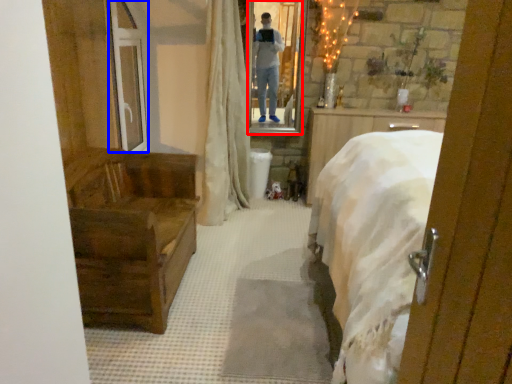
Question: Which object appears farthest to the camera in this image, mirror (highlighted by a red box) or glass door (highlighted by a blue box)?

Choices:
 (A) mirror
 (B) glass door

Answer: (A)